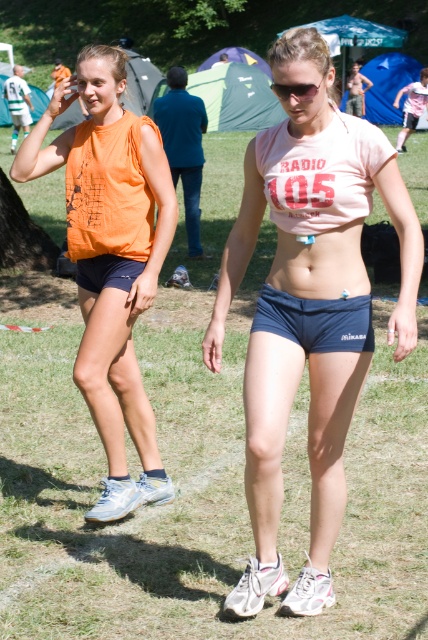
You are organizing a clothing donation drive and need to categorize items by size. If you have an orange fabric tank top at left and a pink matte bikini top at center, which one would you place in the large size bin?

The orange fabric tank top at left is bigger than the pink matte bikini top at center, so it should be placed in the large size bin.